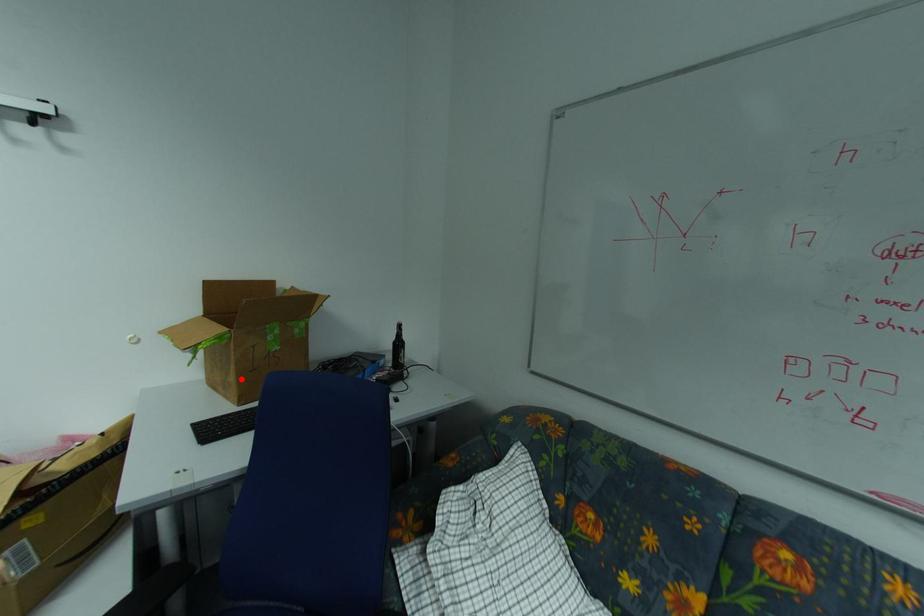
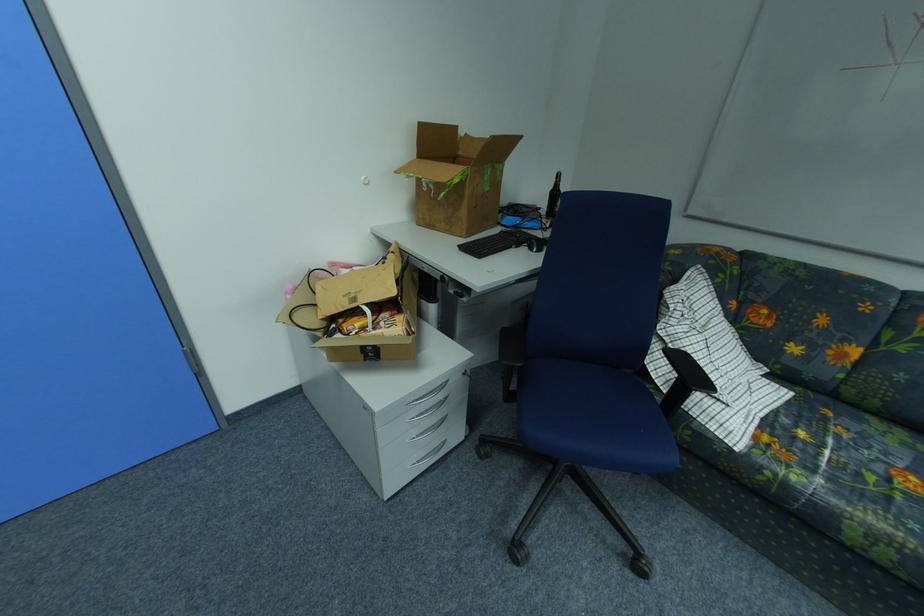
In the second image, find the point that corresponds to the highlighted location in the first image.

(470, 214)